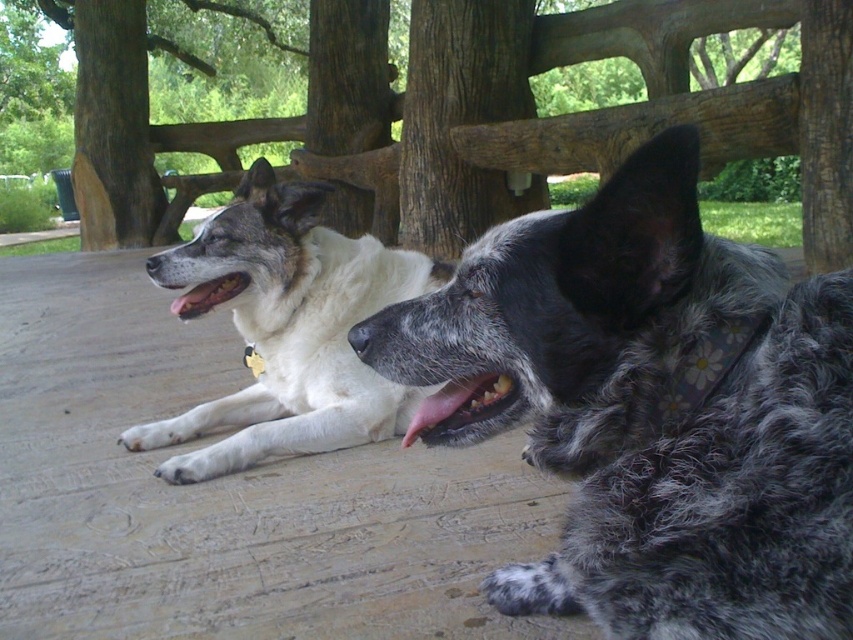
Question: Is spotted fur dog at center bigger than white fur dog at left?

Choices:
 (A) yes
 (B) no

Answer: (B)

Question: Is spotted fur dog at center behind white fur dog at left?

Choices:
 (A) no
 (B) yes

Answer: (A)

Question: Is spotted fur dog at center closer to the viewer compared to white fur dog at left?

Choices:
 (A) yes
 (B) no

Answer: (A)

Question: Which object appears farthest from the camera in this image?

Choices:
 (A) spotted fur dog at center
 (B) white fur dog at left

Answer: (B)